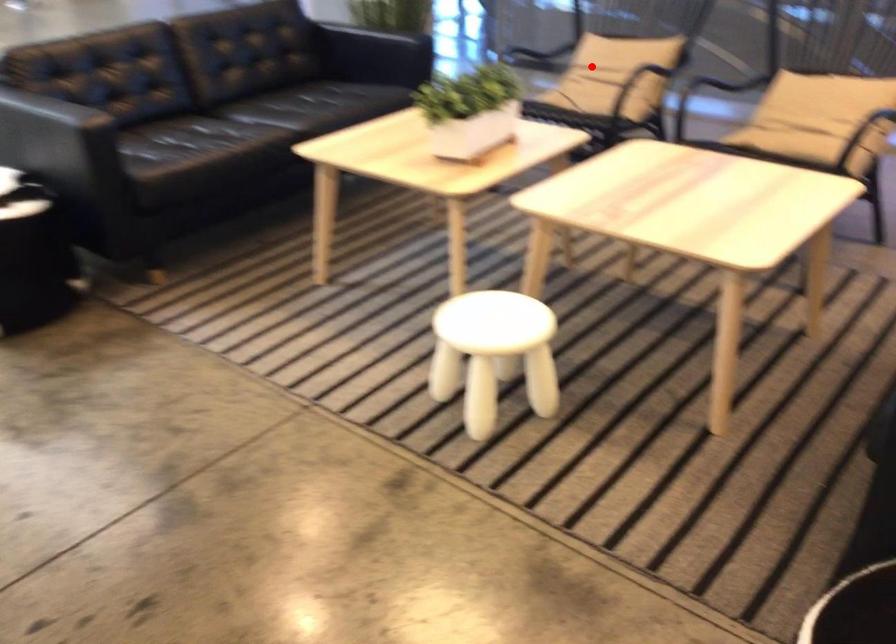
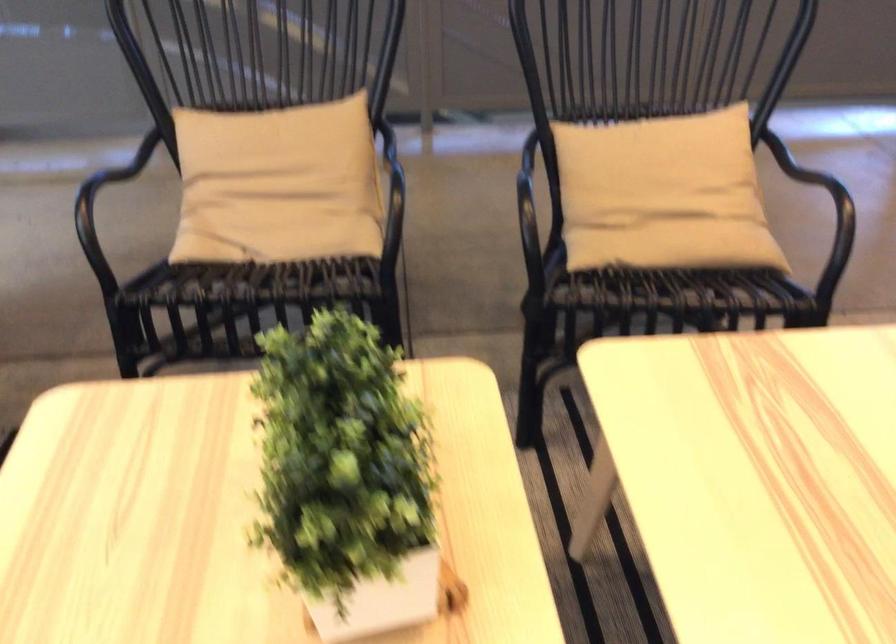
Question: I am providing you with two images of the same scene from different viewpoints. A red point is shown in image1. For the corresponding object point in image2, is it positioned nearer or farther from the camera?

Choices:
 (A) Nearer
 (B) Farther

Answer: (A)